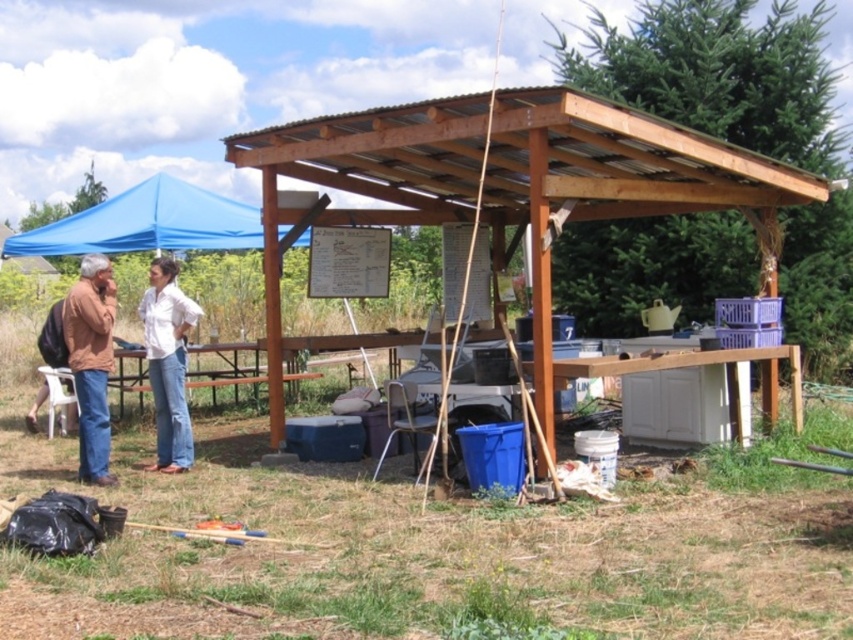
In the scene shown: Can you confirm if brown wooden pergola at center is thinner than white cotton shirt at center?

Incorrect, brown wooden pergola at center's width is not less than white cotton shirt at center's.

Between point (643, 152) and point (158, 308), which one is positioned in front?

Point (643, 152) is in front.

Who is more forward, [546,260] or [160,412]?

Point [546,260] is in front.

Where is `brown wooden pergola at center`? The height and width of the screenshot is (640, 853). brown wooden pergola at center is located at coordinates (508, 184).

Consider the image. Between brown leather jacket at left and matte brown jacket at left, which one appears on the left side from the viewer's perspective?

matte brown jacket at left

Is brown leather jacket at left closer to camera compared to matte brown jacket at left?

Yes, brown leather jacket at left is in front of matte brown jacket at left.

Between point (108, 276) and point (39, 401), which one is positioned behind?

Point (39, 401)

Locate an element on the screen. brown leather jacket at left is located at coordinates (91, 362).

Can you confirm if blue fabric canopy at upper left is positioned to the right of white cotton shirt at center?

Incorrect, blue fabric canopy at upper left is not on the right side of white cotton shirt at center.

Can you confirm if blue fabric canopy at upper left is positioned above white cotton shirt at center?

Yes.

Is point (186, 220) closer to camera compared to point (164, 284)?

No, (186, 220) is further to viewer.

Where is `blue fabric canopy at upper left`? This screenshot has width=853, height=640. blue fabric canopy at upper left is located at coordinates (146, 224).